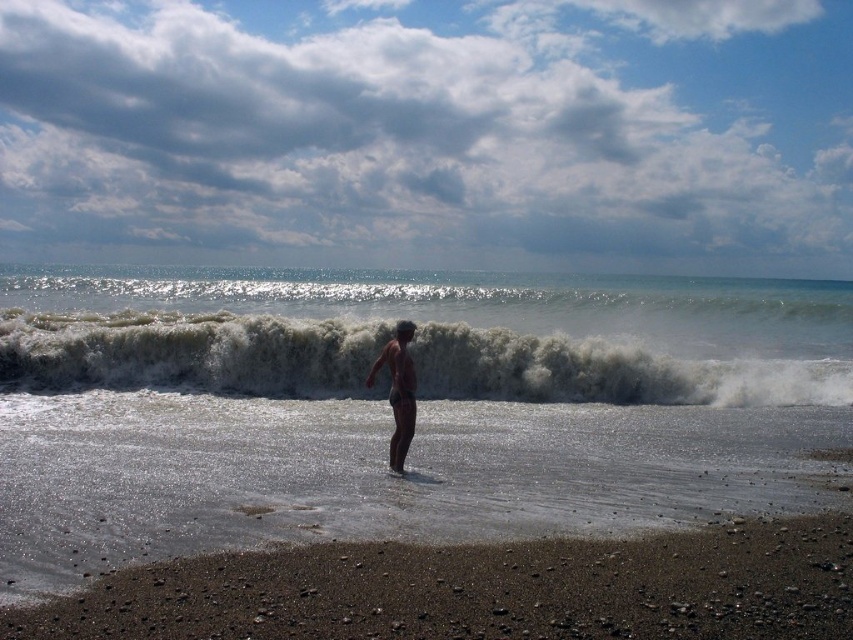
Who is more distant from viewer, (466, 604) or (651, 364)?

Positioned behind is point (651, 364).

Is point (561, 556) positioned after point (155, 346)?

That is False.

What do you see at coordinates (480, 589) in the screenshot? The image size is (853, 640). I see `dark brown pebbles at lower center` at bounding box center [480, 589].

Where is `dark brown pebbles at lower center`? The image size is (853, 640). dark brown pebbles at lower center is located at coordinates (480, 589).

Between white frothy wave at center and brown matte skin at center, which one is positioned lower?

Positioned lower is brown matte skin at center.

Which is behind, point (717, 381) or point (393, 465)?

Point (717, 381)

Which is in front, point (635, 374) or point (398, 374)?

Point (398, 374)

Locate an element on the screen. The height and width of the screenshot is (640, 853). white frothy wave at center is located at coordinates (187, 353).

Is dark brown pebbles at lower center to the right of brown matte skin at center from the viewer's perspective?

Incorrect, dark brown pebbles at lower center is not on the right side of brown matte skin at center.

Where is `dark brown pebbles at lower center`? The height and width of the screenshot is (640, 853). dark brown pebbles at lower center is located at coordinates (480, 589).